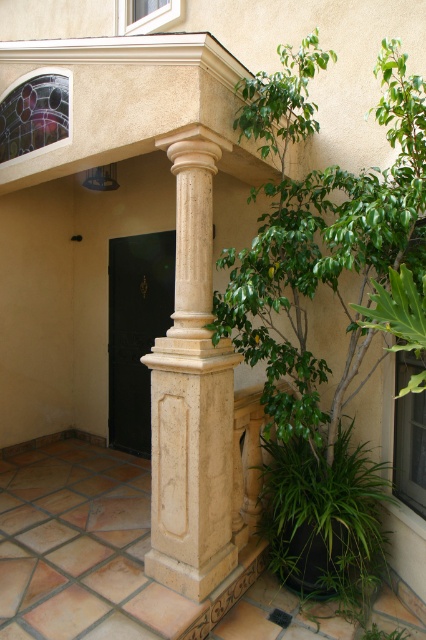
You are a painter standing at the base of the beige stone column at center, looking towards the green leafy plant at lower right. Which object is closer to your eyes?

The green leafy plant at lower right is closer to your eyes because it is positioned at lower right, which is nearer to the base where you are standing compared to the beige stone column at center that is taller and likely further away.

You are a delivery person arriving at this building and need to locate the entrance. You see the beige stone column at center and the black polished door at center. Which object is closer to the entrance?

The black polished door at center is closer to the entrance because it occupies more space than the beige stone column at center, indicating it is the main entry point.

You are a delivery person trying to determine if the green leafy plant at lower right can fit through the black polished door at center. Based on their sizes, can the plant pass through the door?

The green leafy plant at lower right is wider than the black polished door at center, so it cannot fit through the door.